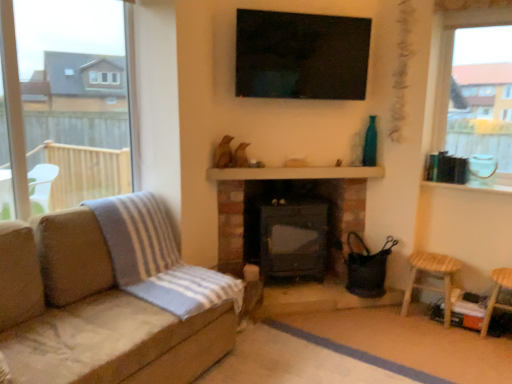
Question: Considering the relative sizes of wooden stool at lower right, which is the first bar stool in left-to-right order, and suede couch at left in the image provided, is wooden stool at lower right, which is the first bar stool in left-to-right order, thinner than suede couch at left?

Choices:
 (A) no
 (B) yes

Answer: (B)

Question: Can you see wooden stool at lower right, which is the first bar stool in left-to-right order, touching suede couch at left?

Choices:
 (A) yes
 (B) no

Answer: (B)

Question: Does wooden stool at lower right, which is counted as the second bar stool, starting from the right, appear on the left side of suede couch at left?

Choices:
 (A) no
 (B) yes

Answer: (A)

Question: From a real-world perspective, is wooden stool at lower right, which is the first bar stool in left-to-right order, under suede couch at left?

Choices:
 (A) no
 (B) yes

Answer: (B)

Question: Can you confirm if wooden stool at lower right, which is counted as the second bar stool, starting from the right, is bigger than suede couch at left?

Choices:
 (A) no
 (B) yes

Answer: (A)

Question: Do you think transparent glass window at left, marked as the first window in a left-to-right arrangement, is within black matte fireplace at center, or outside of it?

Choices:
 (A) outside
 (B) inside

Answer: (A)

Question: In terms of width, does transparent glass window at left, the 2th window positioned from the right, look wider or thinner when compared to black matte fireplace at center?

Choices:
 (A) thin
 (B) wide

Answer: (A)

Question: In terms of height, does transparent glass window at left, the 2th window positioned from the right, look taller or shorter compared to black matte fireplace at center?

Choices:
 (A) tall
 (B) short

Answer: (A)

Question: Does point (20, 205) appear closer or farther from the camera than point (264, 196)?

Choices:
 (A) farther
 (B) closer

Answer: (B)

Question: Does point (449, 304) appear closer or farther from the camera than point (446, 33)?

Choices:
 (A) closer
 (B) farther

Answer: (A)

Question: From a real-world perspective, is wooden stool at lower right, which is the first bar stool in left-to-right order, above or below clear glass window at upper right, the first window positioned from the right?

Choices:
 (A) above
 (B) below

Answer: (B)

Question: Looking at the image, does wooden stool at lower right, which is counted as the second bar stool, starting from the right, seem bigger or smaller compared to clear glass window at upper right, the first window positioned from the right?

Choices:
 (A) big
 (B) small

Answer: (B)

Question: Is wooden stool at lower right, which is counted as the second bar stool, starting from the right, wider or thinner than clear glass window at upper right, the first window positioned from the right?

Choices:
 (A) thin
 (B) wide

Answer: (B)

Question: Considering their positions, is wooden stool at lower right, which ranks as the first bar stool in right-to-left order, located in front of or behind black matte fireplace at center?

Choices:
 (A) front
 (B) behind

Answer: (A)

Question: From the image's perspective, relative to black matte fireplace at center, is wooden stool at lower right, placed as the second bar stool when sorted from left to right, above or below?

Choices:
 (A) above
 (B) below

Answer: (B)